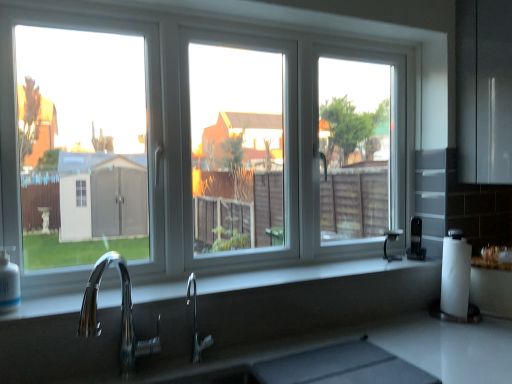
Question: In which direction should I rotate to look at polished chrome faucet at center, which is counted as the 2th tap, starting from the left?

Choices:
 (A) right
 (B) left

Answer: (B)

Question: Is black plastic coffee maker at right directly adjacent to polished chrome faucet at center, placed as the first tap when sorted from back to front?

Choices:
 (A) yes
 (B) no

Answer: (B)

Question: Can you confirm if black plastic coffee maker at right is smaller than polished chrome faucet at center, placed as the 2th tap when sorted from front to back?

Choices:
 (A) yes
 (B) no

Answer: (B)

Question: Considering the relative positions of black plastic coffee maker at right and polished chrome faucet at center, placed as the 2th tap when sorted from front to back, in the image provided, is black plastic coffee maker at right in front of polished chrome faucet at center, placed as the 2th tap when sorted from front to back,?

Choices:
 (A) no
 (B) yes

Answer: (A)

Question: From the image's perspective, is black plastic coffee maker at right beneath polished chrome faucet at center, placed as the 2th tap when sorted from front to back?

Choices:
 (A) no
 (B) yes

Answer: (A)

Question: Can you confirm if black plastic coffee maker at right is thinner than polished chrome faucet at center, the first tap viewed from the right?

Choices:
 (A) no
 (B) yes

Answer: (A)

Question: Is the position of black plastic coffee maker at right more distant than that of polished chrome faucet at center, placed as the 2th tap when sorted from front to back?

Choices:
 (A) no
 (B) yes

Answer: (B)

Question: From the image's perspective, is black plastic coffee maker at right under white plastic window at center?

Choices:
 (A) yes
 (B) no

Answer: (A)

Question: Does black plastic coffee maker at right have a greater height compared to white plastic window at center?

Choices:
 (A) no
 (B) yes

Answer: (A)

Question: Does black plastic coffee maker at right have a smaller size compared to white plastic window at center?

Choices:
 (A) yes
 (B) no

Answer: (A)

Question: Is the depth of black plastic coffee maker at right less than that of white plastic window at center?

Choices:
 (A) yes
 (B) no

Answer: (B)

Question: Can you confirm if black plastic coffee maker at right is bigger than white plastic window at center?

Choices:
 (A) yes
 (B) no

Answer: (B)

Question: Can you confirm if black plastic coffee maker at right is shorter than white plastic window at center?

Choices:
 (A) no
 (B) yes

Answer: (B)

Question: From the image's perspective, is black plastic coffee maker at right over chrome/metallic faucet at lower left, acting as the second tap starting from the back?

Choices:
 (A) no
 (B) yes

Answer: (B)